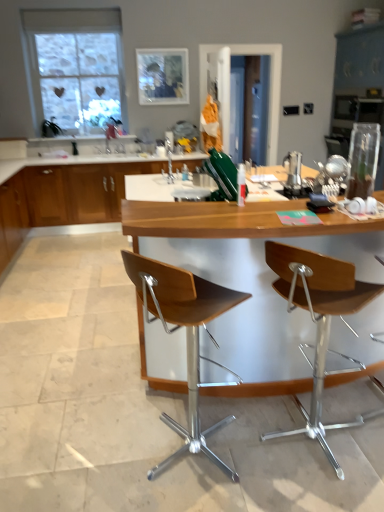
Where is `woodenmaterial/texturetable at center`? woodenmaterial/texturetable at center is located at coordinates (248, 278).

This screenshot has height=512, width=384. What do you see at coordinates (76, 67) in the screenshot? I see `clear glass window at upper left` at bounding box center [76, 67].

What is the approximate height of clear glass window at upper left?

It is 1.24 meters.

Where is `wooden seat at right, the 1th chair in the right-to-left sequence`? The image size is (384, 512). wooden seat at right, the 1th chair in the right-to-left sequence is located at coordinates (319, 322).

Describe the element at coordinates (186, 336) in the screenshot. The height and width of the screenshot is (512, 384). I see `wooden seat at center, arranged as the second chair when viewed from the right` at that location.

Locate an element on the screen. woodenmaterial/texturetable at center is located at coordinates (248, 278).

Could you tell me if clear glass window at upper left is turned towards wooden cabinet at center?

No, clear glass window at upper left does not turn towards wooden cabinet at center.

From a real-world perspective, does clear glass window at upper left stand above wooden cabinet at center?

Yes.

Can you tell me how much clear glass window at upper left and wooden cabinet at center differ in facing direction?

There is a 0.05-degree angle between the facing directions of clear glass window at upper left and wooden cabinet at center.

Considering the relative sizes of clear glass window at upper left and wooden cabinet at center in the image provided, is clear glass window at upper left wider than wooden cabinet at center?

In fact, clear glass window at upper left might be narrower than wooden cabinet at center.

From a real-world perspective, which chair is the 1st one above the wooden cabinet at center? Please provide its 2D coordinates.

[(186, 336)]

Consider the image. Are wooden seat at center, arranged as the second chair when viewed from the right, and wooden cabinet at center located far from each other?

Yes, wooden seat at center, arranged as the second chair when viewed from the right, and wooden cabinet at center are located far from each other.

Which object is further away from the camera taking this photo, wooden seat at center, the first chair viewed from the left, or wooden cabinet at center?

wooden cabinet at center is more distant.

Measure the distance from wooden seat at center, arranged as the second chair when viewed from the right, to wooden cabinet at center.

3.46 meters.

Can you confirm if woodenmaterial/texturetable at center is smaller than wooden seat at right, the 2th chair from the left?

Incorrect, woodenmaterial/texturetable at center is not smaller in size than wooden seat at right, the 2th chair from the left.

From the image's perspective, which object appears higher, woodenmaterial/texturetable at center or wooden seat at right, the 2th chair from the left?

woodenmaterial/texturetable at center, from the image's perspective.

Where is `table above the wooden seat at right, the 2th chair from the left (from a real-world perspective)`? table above the wooden seat at right, the 2th chair from the left (from a real-world perspective) is located at coordinates (248, 278).

Considering the points (277, 338) and (329, 260), which point is behind, point (277, 338) or point (329, 260)?

Point (277, 338)

Looking at this image, is wooden cabinet at center turned away from wooden seat at right, the 1th chair in the right-to-left sequence?

No, wooden cabinet at center is not facing the opposite direction of wooden seat at right, the 1th chair in the right-to-left sequence.

Do you think wooden cabinet at center is within wooden seat at right, the 2th chair from the left, or outside of it?

The correct answer is: outside.

From the image's perspective, is wooden cabinet at center above or below wooden seat at right, the 1th chair in the right-to-left sequence?

Clearly, from the image's perspective, wooden cabinet at center is above wooden seat at right, the 1th chair in the right-to-left sequence.

Considering the positions of point (88, 193) and point (340, 471), is point (88, 193) closer or farther from the camera than point (340, 471)?

Point (88, 193) is positioned farther from the camera compared to point (340, 471).

In terms of size, does wooden cabinet at center appear bigger or smaller than clear glass window at upper left?

wooden cabinet at center is bigger than clear glass window at upper left.

Is wooden cabinet at center further to camera compared to clear glass window at upper left?

That is False.

Is wooden cabinet at center aimed at clear glass window at upper left?

No, wooden cabinet at center does not turn towards clear glass window at upper left.

Where is `chair directly beneath the wooden seat at right, the 2th chair from the left (from a real-world perspective)`? The width and height of the screenshot is (384, 512). chair directly beneath the wooden seat at right, the 2th chair from the left (from a real-world perspective) is located at coordinates (186, 336).

Looking at the image, does wooden seat at right, the 1th chair in the right-to-left sequence, seem bigger or smaller compared to wooden seat at center, the first chair viewed from the left?

Clearly, wooden seat at right, the 1th chair in the right-to-left sequence, is smaller in size than wooden seat at center, the first chair viewed from the left.

How distant is wooden seat at right, the 2th chair from the left, from wooden seat at center, arranged as the second chair when viewed from the right?

wooden seat at right, the 2th chair from the left, is 32.07 inches away from wooden seat at center, arranged as the second chair when viewed from the right.

Which is behind, wooden seat at center, arranged as the second chair when viewed from the right, or clear glass window at upper left?

Positioned behind is clear glass window at upper left.

From a real-world perspective, is wooden seat at center, arranged as the second chair when viewed from the right, located beneath clear glass window at upper left?

Yes.

Can you confirm if wooden seat at center, the first chair viewed from the left, is wider than clear glass window at upper left?

Correct, the width of wooden seat at center, the first chair viewed from the left, exceeds that of clear glass window at upper left.

Considering the sizes of objects wooden seat at center, the first chair viewed from the left, and clear glass window at upper left in the image provided, who is smaller, wooden seat at center, the first chair viewed from the left, or clear glass window at upper left?

clear glass window at upper left.

This screenshot has width=384, height=512. Find the location of `cabinetry that appears in front of the clear glass window at upper left`. cabinetry that appears in front of the clear glass window at upper left is located at coordinates tap(79, 192).

The height and width of the screenshot is (512, 384). I want to click on cabinetry on the left side of wooden seat at center, the first chair viewed from the left, so click(x=79, y=192).

Considering their positions, is clear glass window at upper left positioned further to wooden seat at center, arranged as the second chair when viewed from the right, than woodenmaterial/texturetable at center?

Among the two, clear glass window at upper left is located further to wooden seat at center, arranged as the second chair when viewed from the right.

From the image, which object appears to be nearer to wooden seat at right, the 2th chair from the left, wooden seat at center, the first chair viewed from the left, or woodenmaterial/texturetable at center?

Based on the image, woodenmaterial/texturetable at center appears to be nearer to wooden seat at right, the 2th chair from the left.

From the image, which object appears to be farther from clear glass window at upper left, woodenmaterial/texturetable at center or wooden seat at right, the 2th chair from the left?

wooden seat at right, the 2th chair from the left, is further to clear glass window at upper left.

Looking at the image, which one is located further to clear glass window at upper left, wooden seat at center, arranged as the second chair when viewed from the right, or wooden cabinet at center?

wooden seat at center, arranged as the second chair when viewed from the right.

Looking at the image, which one is located closer to woodenmaterial/texturetable at center, wooden seat at center, arranged as the second chair when viewed from the right, or wooden seat at right, the 1th chair in the right-to-left sequence?

wooden seat at center, arranged as the second chair when viewed from the right, is closer to woodenmaterial/texturetable at center.

Estimate the real-world distances between objects in this image. Which object is further from wooden cabinet at center, wooden seat at center, the first chair viewed from the left, or clear glass window at upper left?

Based on the image, wooden seat at center, the first chair viewed from the left, appears to be further to wooden cabinet at center.

Looking at the image, which one is located closer to woodenmaterial/texturetable at center, wooden seat at center, arranged as the second chair when viewed from the right, or clear glass window at upper left?

wooden seat at center, arranged as the second chair when viewed from the right.

Looking at this image, which object lies nearer to the anchor point clear glass window at upper left, woodenmaterial/texturetable at center or wooden cabinet at center?

Among the two, wooden cabinet at center is located nearer to clear glass window at upper left.

In order to click on chair between wooden seat at center, the first chair viewed from the left, and wooden cabinet at center from front to back in this screenshot , I will do `click(319, 322)`.

Find the location of a particular element. The width and height of the screenshot is (384, 512). chair between wooden seat at center, arranged as the second chair when viewed from the right, and clear glass window at upper left in the front-back direction is located at coordinates (319, 322).

Locate an element on the screen. cabinetry located between woodenmaterial/texturetable at center and clear glass window at upper left in the depth direction is located at coordinates (79, 192).

The image size is (384, 512). I want to click on table between wooden seat at right, the 1th chair in the right-to-left sequence, and clear glass window at upper left from front to back, so click(x=248, y=278).